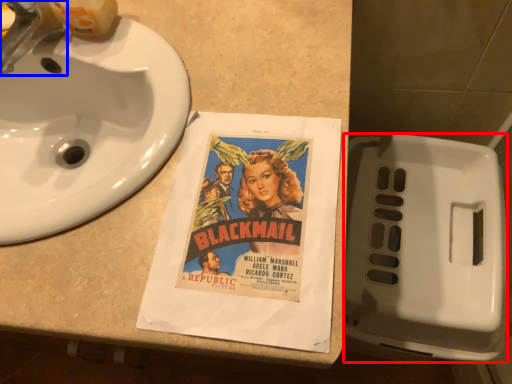
Question: Which of the following is the closest to the observer, toilet (highlighted by a red box) or faucet (highlighted by a blue box)?

Choices:
 (A) toilet
 (B) faucet

Answer: (B)